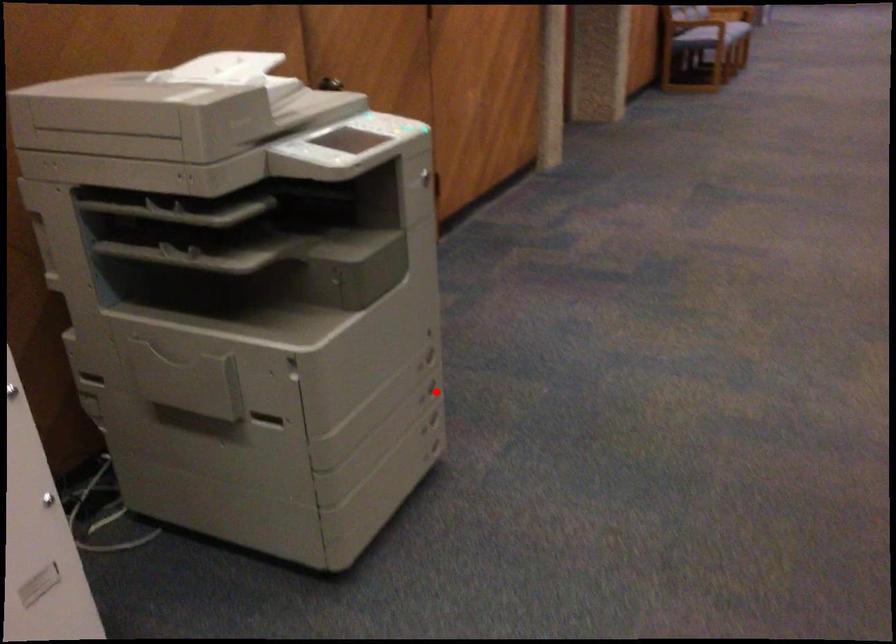
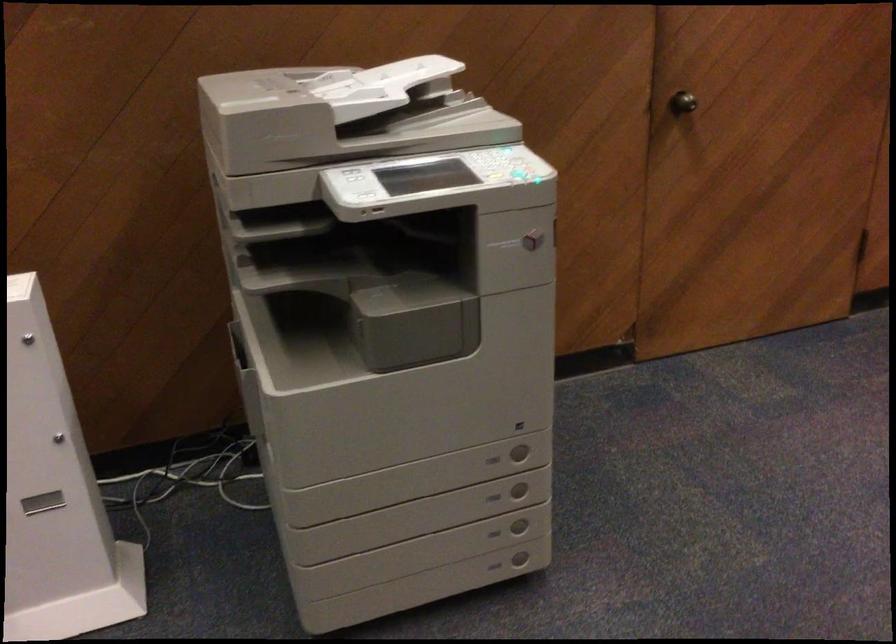
Question: I am providing you with two images of the same scene from different viewpoints. Image1 has a red point marked. In image2, the corresponding 3D location appears at what relative position? Reply with the corresponding letter.

Choices:
 (A) Closer
 (B) Farther

Answer: (A)